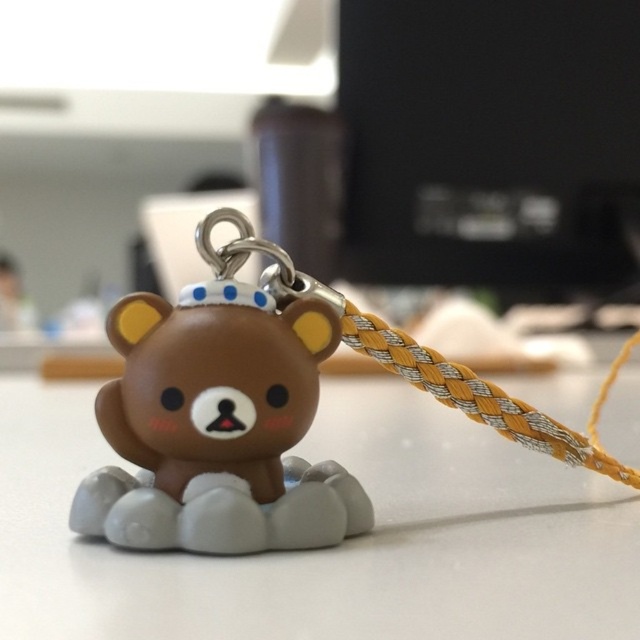
Question: Can you confirm if white matte table at center is positioned to the right of matte brown plush bear at center?

Choices:
 (A) no
 (B) yes

Answer: (A)

Question: Does white matte table at center lie behind matte brown plush bear at center?

Choices:
 (A) yes
 (B) no

Answer: (B)

Question: Can you confirm if white matte table at center is positioned below matte brown plush bear at center?

Choices:
 (A) no
 (B) yes

Answer: (B)

Question: Which point is farther to the camera?

Choices:
 (A) [333, 515]
 (B) [536, 589]

Answer: (A)

Question: Which point is farther from the camera taking this photo?

Choices:
 (A) (196, 486)
 (B) (522, 497)

Answer: (B)